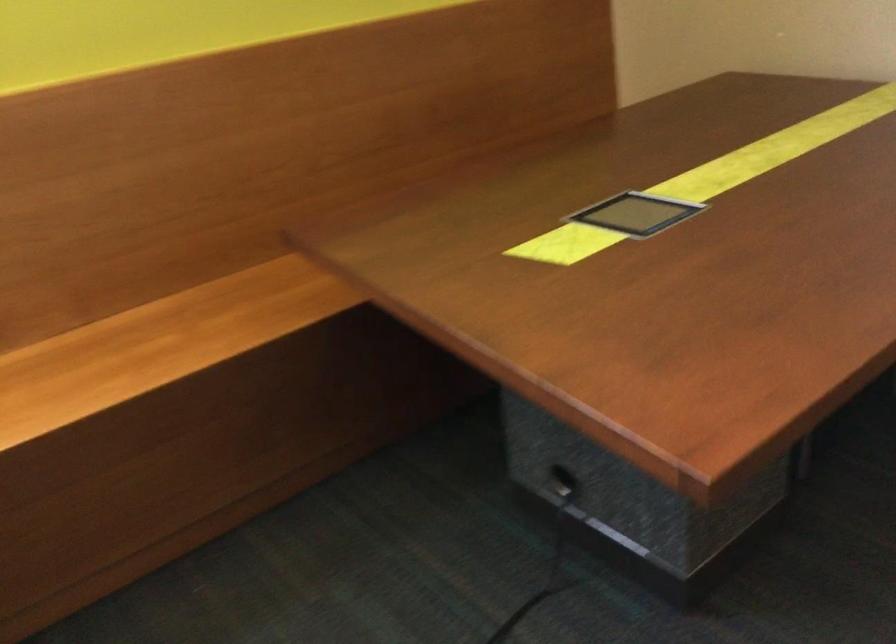
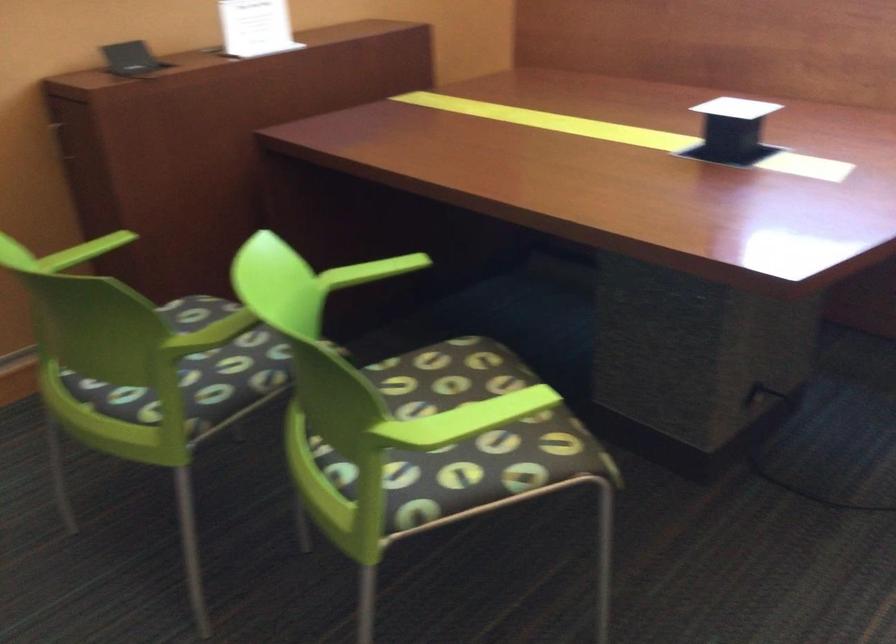
The first image is from the beginning of the video and the second image is from the end. How did the camera likely rotate when shooting the video?

The camera's rotation is toward left-down.